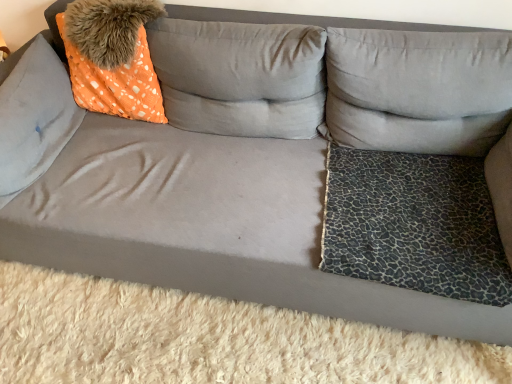
What do you see at coordinates (418, 90) in the screenshot? I see `leopard print fabric pillow at right, the 1th pillow when ordered from right to left` at bounding box center [418, 90].

What do you see at coordinates (34, 116) in the screenshot? The width and height of the screenshot is (512, 384). I see `suede orange pillow at left, acting as the 1th pillow starting from the left` at bounding box center [34, 116].

Identify the location of orange dotted fabric at upper left. (112, 57).

Where is `pillow below the orange dotted fabric pillow at upper left, which is the 2th pillow in right-to-left order (from a real-world perspective)`? pillow below the orange dotted fabric pillow at upper left, which is the 2th pillow in right-to-left order (from a real-world perspective) is located at coordinates (34, 116).

Is orange dotted fabric pillow at upper left, acting as the second pillow starting from the left, wider or thinner than suede orange pillow at left, the third pillow positioned from the right?

Clearly, orange dotted fabric pillow at upper left, acting as the second pillow starting from the left, has more width compared to suede orange pillow at left, the third pillow positioned from the right.

Is orange dotted fabric pillow at upper left, acting as the second pillow starting from the left, aimed at suede orange pillow at left, the third pillow positioned from the right?

No, orange dotted fabric pillow at upper left, acting as the second pillow starting from the left, does not turn towards suede orange pillow at left, the third pillow positioned from the right.

Is suede orange pillow at left, acting as the 1th pillow starting from the left, completely or partially inside orange dotted fabric pillow at upper left, acting as the second pillow starting from the left?

No, suede orange pillow at left, acting as the 1th pillow starting from the left, is not inside orange dotted fabric pillow at upper left, acting as the second pillow starting from the left.

Is the depth of orange dotted fabric at upper left greater than that of orange dotted fabric pillow at upper left, acting as the second pillow starting from the left?

Yes.

Can you confirm if orange dotted fabric at upper left is shorter than orange dotted fabric pillow at upper left, which is the 2th pillow in right-to-left order?

Yes, orange dotted fabric at upper left is shorter than orange dotted fabric pillow at upper left, which is the 2th pillow in right-to-left order.

Do you think orange dotted fabric at upper left is within orange dotted fabric pillow at upper left, acting as the second pillow starting from the left, or outside of it?

orange dotted fabric at upper left cannot be found inside orange dotted fabric pillow at upper left, acting as the second pillow starting from the left.

In the image, is suede orange pillow at left, the third pillow positioned from the right, on the left side or the right side of orange dotted fabric at upper left?

In the image, suede orange pillow at left, the third pillow positioned from the right, appears on the left side of orange dotted fabric at upper left.

From a real-world perspective, is suede orange pillow at left, the third pillow positioned from the right, positioned above or below orange dotted fabric at upper left?

In terms of real-world spatial position, suede orange pillow at left, the third pillow positioned from the right, is below orange dotted fabric at upper left.

Which object is further away from the camera, suede orange pillow at left, acting as the 1th pillow starting from the left, or orange dotted fabric at upper left?

orange dotted fabric at upper left is behind.

You are a GUI agent. You are given a task and a screenshot of the screen. Output one action in this format:
    pyautogui.click(x=<x>, y=<y>)
    Task: Click on the pillow on the left of orange dotted fabric at upper left
    The width and height of the screenshot is (512, 384).
    Given the screenshot: What is the action you would take?
    pyautogui.click(x=34, y=116)

Can you confirm if orange dotted fabric at upper left is positioned to the right of leopard print fabric dog bed at lower right?

Incorrect, orange dotted fabric at upper left is not on the right side of leopard print fabric dog bed at lower right.

Does orange dotted fabric at upper left have a smaller size compared to leopard print fabric dog bed at lower right?

No.

Considering the relative sizes of orange dotted fabric at upper left and leopard print fabric dog bed at lower right in the image provided, is orange dotted fabric at upper left wider than leopard print fabric dog bed at lower right?

In fact, orange dotted fabric at upper left might be narrower than leopard print fabric dog bed at lower right.

From the image's perspective, which one is positioned higher, orange dotted fabric at upper left or leopard print fabric dog bed at lower right?

orange dotted fabric at upper left.

Between leopard print fabric pillow at right, which is the third pillow from left to right, and leopard print fabric dog bed at lower right, which one has larger size?

leopard print fabric pillow at right, which is the third pillow from left to right, is bigger.

How much distance is there between leopard print fabric pillow at right, the 1th pillow when ordered from right to left, and leopard print fabric dog bed at lower right?

They are 11.09 inches apart.

Is leopard print fabric pillow at right, the 1th pillow when ordered from right to left, wider or thinner than leopard print fabric dog bed at lower right?

Considering their sizes, leopard print fabric pillow at right, the 1th pillow when ordered from right to left, looks slimmer than leopard print fabric dog bed at lower right.

Is leopard print fabric pillow at right, the 1th pillow when ordered from right to left, oriented away from leopard print fabric dog bed at lower right?

No, leopard print fabric pillow at right, the 1th pillow when ordered from right to left, is not facing away from leopard print fabric dog bed at lower right.

Which is in front, leopard print fabric dog bed at lower right or suede orange pillow at left, acting as the 1th pillow starting from the left?

leopard print fabric dog bed at lower right is in front.

Is suede orange pillow at left, the third pillow positioned from the right, at the back of leopard print fabric dog bed at lower right?

leopard print fabric dog bed at lower right does not have its back to suede orange pillow at left, the third pillow positioned from the right.

From a real-world perspective, is leopard print fabric dog bed at lower right above or below suede orange pillow at left, the third pillow positioned from the right?

leopard print fabric dog bed at lower right is situated lower than suede orange pillow at left, the third pillow positioned from the right, in the real world.

Can suede orange pillow at left, the third pillow positioned from the right, be found inside leopard print fabric dog bed at lower right?

No.

Considering the points (39, 130) and (439, 226), which point is in front, point (39, 130) or point (439, 226)?

Positioned in front is point (439, 226).

Is suede orange pillow at left, the third pillow positioned from the right, in front of or behind leopard print fabric dog bed at lower right in the image?

In the image, suede orange pillow at left, the third pillow positioned from the right, appears behind leopard print fabric dog bed at lower right.

In the scene shown: Considering the relative sizes of suede orange pillow at left, acting as the 1th pillow starting from the left, and leopard print fabric dog bed at lower right in the image provided, is suede orange pillow at left, acting as the 1th pillow starting from the left, bigger than leopard print fabric dog bed at lower right?

Correct, suede orange pillow at left, acting as the 1th pillow starting from the left, is larger in size than leopard print fabric dog bed at lower right.

You are a GUI agent. You are given a task and a screenshot of the screen. Output one action in this format:
    pyautogui.click(x=<x>, y=<y>)
    Task: Click on the 1st pillow directly above the suede orange pillow at left, the third pillow positioned from the right (from a real-world perspective)
    Image resolution: width=512 pixels, height=384 pixels.
    Given the screenshot: What is the action you would take?
    pyautogui.click(x=240, y=77)

Identify the location of throw pillow on the left of orange dotted fabric pillow at upper left, which is the 2th pillow in right-to-left order. The height and width of the screenshot is (384, 512). (112, 57).

Considering their positions, is orange dotted fabric pillow at upper left, acting as the second pillow starting from the left, positioned closer to orange dotted fabric at upper left than leopard print fabric dog bed at lower right?

orange dotted fabric pillow at upper left, acting as the second pillow starting from the left, is closer to orange dotted fabric at upper left.

From the picture: Which object lies nearer to the anchor point leopard print fabric pillow at right, the 1th pillow when ordered from right to left, leopard print fabric dog bed at lower right or orange dotted fabric pillow at upper left, which is the 2th pillow in right-to-left order?

Among the two, leopard print fabric dog bed at lower right is located nearer to leopard print fabric pillow at right, the 1th pillow when ordered from right to left.

When comparing their distances from orange dotted fabric at upper left, does leopard print fabric dog bed at lower right or suede orange pillow at left, acting as the 1th pillow starting from the left, seem closer?

suede orange pillow at left, acting as the 1th pillow starting from the left, is closer to orange dotted fabric at upper left.

From the image, which object appears to be nearer to suede orange pillow at left, the third pillow positioned from the right, orange dotted fabric at upper left or orange dotted fabric pillow at upper left, acting as the second pillow starting from the left?

Based on the image, orange dotted fabric at upper left appears to be nearer to suede orange pillow at left, the third pillow positioned from the right.

Based on their spatial positions, is orange dotted fabric pillow at upper left, which is the 2th pillow in right-to-left order, or leopard print fabric pillow at right, which is the third pillow from left to right, further from suede orange pillow at left, the third pillow positioned from the right?

The object further to suede orange pillow at left, the third pillow positioned from the right, is leopard print fabric pillow at right, which is the third pillow from left to right.

Looking at the image, which one is located further to leopard print fabric dog bed at lower right, suede orange pillow at left, the third pillow positioned from the right, or leopard print fabric pillow at right, the 1th pillow when ordered from right to left?

suede orange pillow at left, the third pillow positioned from the right, is positioned further to the anchor leopard print fabric dog bed at lower right.

Based on their spatial positions, is leopard print fabric pillow at right, the 1th pillow when ordered from right to left, or suede orange pillow at left, the third pillow positioned from the right, closer to orange dotted fabric pillow at upper left, acting as the second pillow starting from the left?

Among the two, leopard print fabric pillow at right, the 1th pillow when ordered from right to left, is located nearer to orange dotted fabric pillow at upper left, acting as the second pillow starting from the left.

Which object lies further to the anchor point leopard print fabric dog bed at lower right, leopard print fabric pillow at right, the 1th pillow when ordered from right to left, or orange dotted fabric at upper left?

orange dotted fabric at upper left is positioned further to the anchor leopard print fabric dog bed at lower right.

The width and height of the screenshot is (512, 384). Find the location of `pillow between suede orange pillow at left, the third pillow positioned from the right, and leopard print fabric dog bed at lower right from left to right`. pillow between suede orange pillow at left, the third pillow positioned from the right, and leopard print fabric dog bed at lower right from left to right is located at coordinates (240, 77).

Locate an element on the screen. dog bed between orange dotted fabric pillow at upper left, acting as the second pillow starting from the left, and leopard print fabric pillow at right, the 1th pillow when ordered from right to left, in the horizontal direction is located at coordinates (414, 224).

Image resolution: width=512 pixels, height=384 pixels. Find the location of `pillow situated between orange dotted fabric at upper left and leopard print fabric pillow at right, the 1th pillow when ordered from right to left, from left to right`. pillow situated between orange dotted fabric at upper left and leopard print fabric pillow at right, the 1th pillow when ordered from right to left, from left to right is located at coordinates (240, 77).

Locate an element on the screen. dog bed between suede orange pillow at left, the third pillow positioned from the right, and leopard print fabric pillow at right, which is the third pillow from left to right, from left to right is located at coordinates (414, 224).